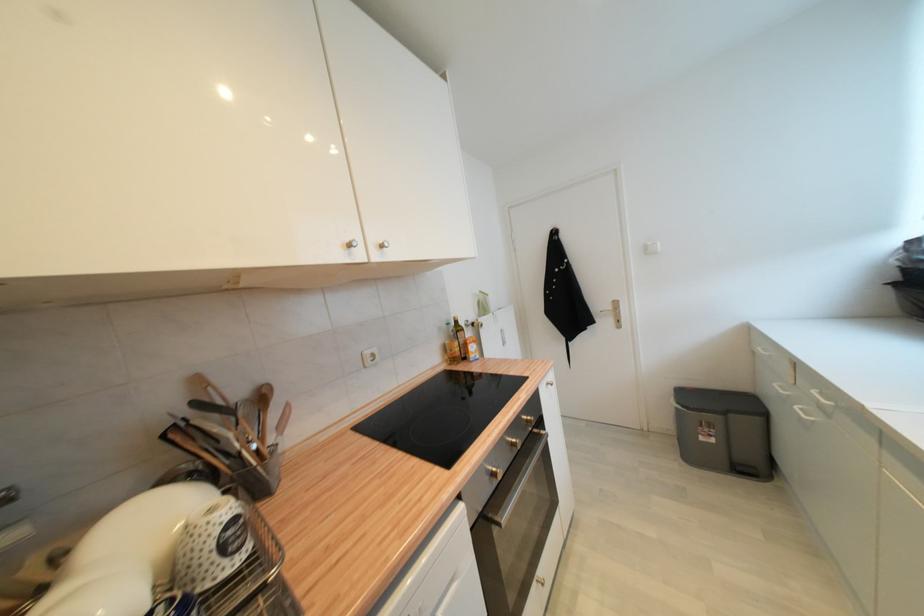
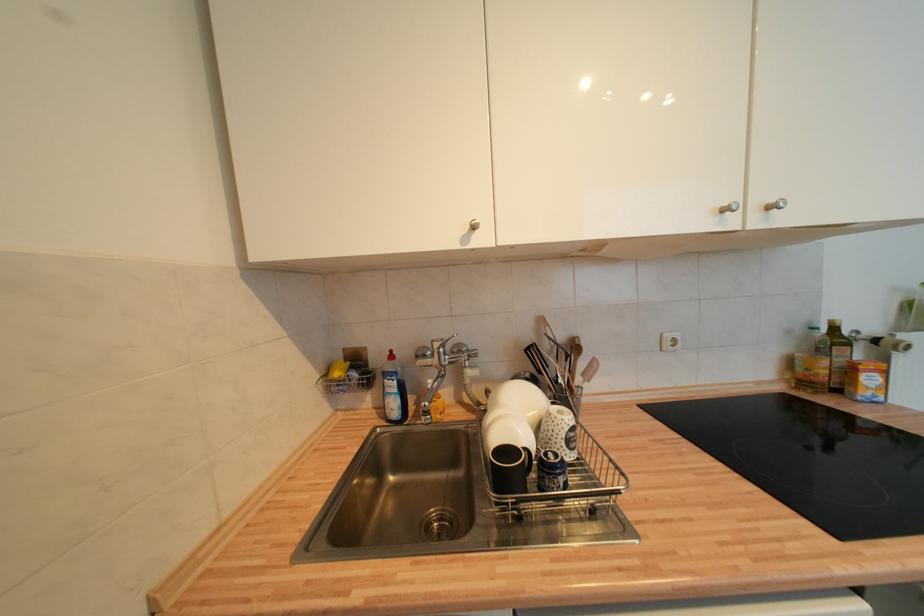
Where in the second image is the point corresponding to point (462, 323) from the first image?

(840, 331)